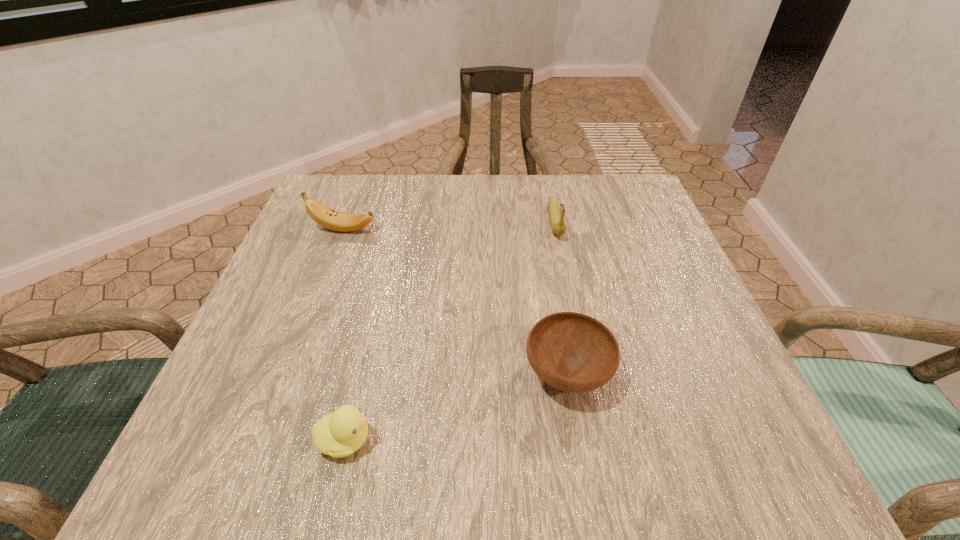
I want to click on free space that satisfies the following two spatial constraints: 1. at the stem of the right banana; 2. at the beak of the duckling, so click(601, 440).

Where is `free point that satisfies the following two spatial constraints: 1. at the stem of the right banana; 2. at the beak of the duckling`? This screenshot has height=540, width=960. free point that satisfies the following two spatial constraints: 1. at the stem of the right banana; 2. at the beak of the duckling is located at coordinates (601, 440).